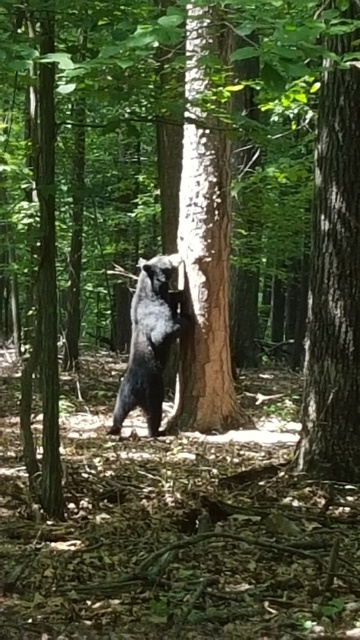
Question: Observing the image, what is the correct spatial positioning of smooth brown tree trunk at right in reference to shiny black bear at center?

Choices:
 (A) right
 (B) left

Answer: (A)

Question: Which object appears farthest from the camera in this image?

Choices:
 (A) smooth brown tree trunk at right
 (B) brown rough tree trunk at center

Answer: (B)

Question: Is brown rough tree trunk at center to the right of shiny black bear at center from the viewer's perspective?

Choices:
 (A) yes
 (B) no

Answer: (A)

Question: Which point is farther to the camera?

Choices:
 (A) (186, 353)
 (B) (327, 72)
 (C) (137, 385)

Answer: (A)

Question: Does smooth brown tree trunk at right appear under brown rough tree trunk at center?

Choices:
 (A) no
 (B) yes

Answer: (A)

Question: Which point is closer to the camera taking this photo?

Choices:
 (A) (311, 278)
 (B) (191, 148)

Answer: (A)